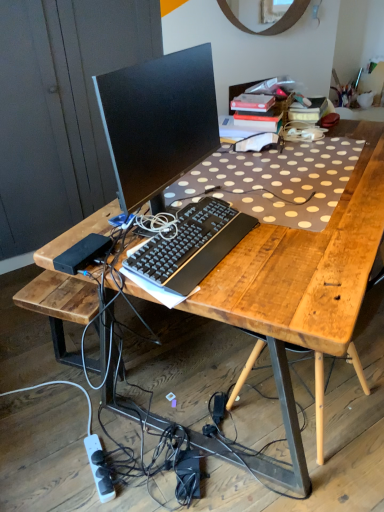
Find the location of a particular element. vacant area situated to the left side of white plastic power strip at lower left is located at coordinates (48, 466).